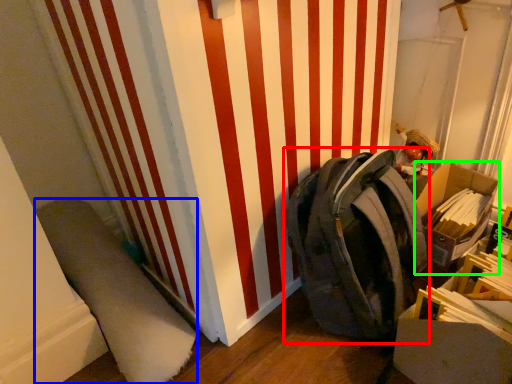
Question: Based on their relative distances, which object is nearer to backpack (highlighted by a red box)? Choose from wide (highlighted by a blue box) and cardboard box (highlighted by a green box).

Choices:
 (A) wide
 (B) cardboard box

Answer: (B)